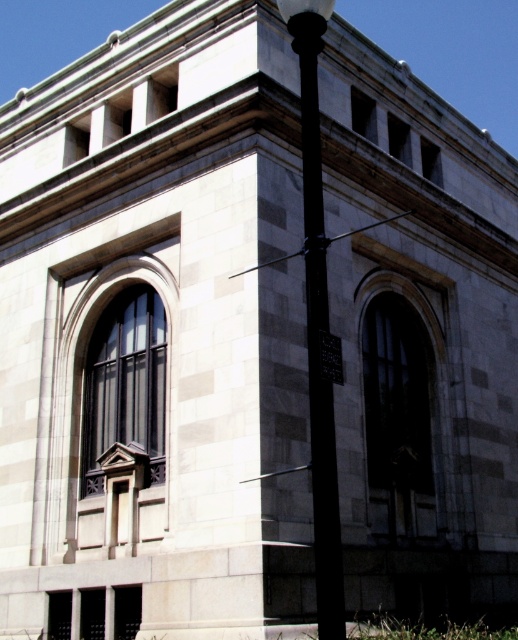
Question: Is the position of black metal pole at center less distant than that of black plastic sign at center?

Choices:
 (A) no
 (B) yes

Answer: (B)

Question: Which object is closer to the camera taking this photo?

Choices:
 (A) black metal pole at center
 (B) black plastic sign at center

Answer: (A)

Question: Is black metal pole at center to the right of black plastic sign at center from the viewer's perspective?

Choices:
 (A) yes
 (B) no

Answer: (B)

Question: Is black metal pole at center smaller than black plastic sign at center?

Choices:
 (A) yes
 (B) no

Answer: (B)

Question: Among these objects, which one is farthest from the camera?

Choices:
 (A) black metal pole at center
 (B) black plastic sign at center

Answer: (B)

Question: Among these points, which one is nearest to the camera?

Choices:
 (A) (337, 378)
 (B) (333, 618)

Answer: (B)